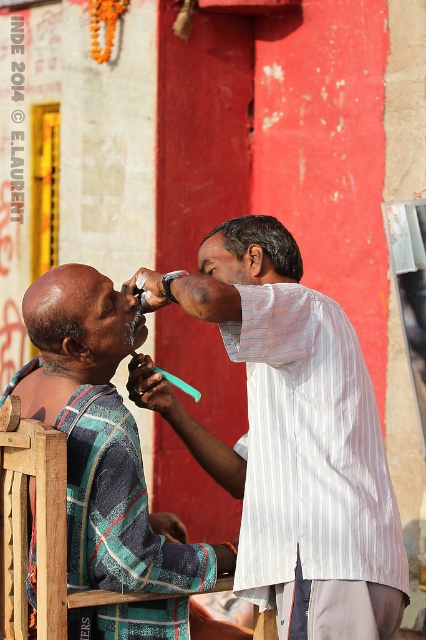
You are a customer waiting to get a haircut at this barber shop. You see two men wearing shirts. One is wearing a white striped shirt at upper center and the other is wearing a striped fabric shirt at left. Which shirt is nearer to you?

The white striped shirt at upper center is closer to the viewer than the striped fabric shirt at left, so the white striped shirt at upper center is nearer to you.

You are a tailor observing two shirts in a scene. The shirts are labeled as the white striped shirt at upper center and the striped fabric shirt at left. Which shirt is smaller in size?

The white striped shirt at upper center is smaller in size compared to the striped fabric shirt at left.